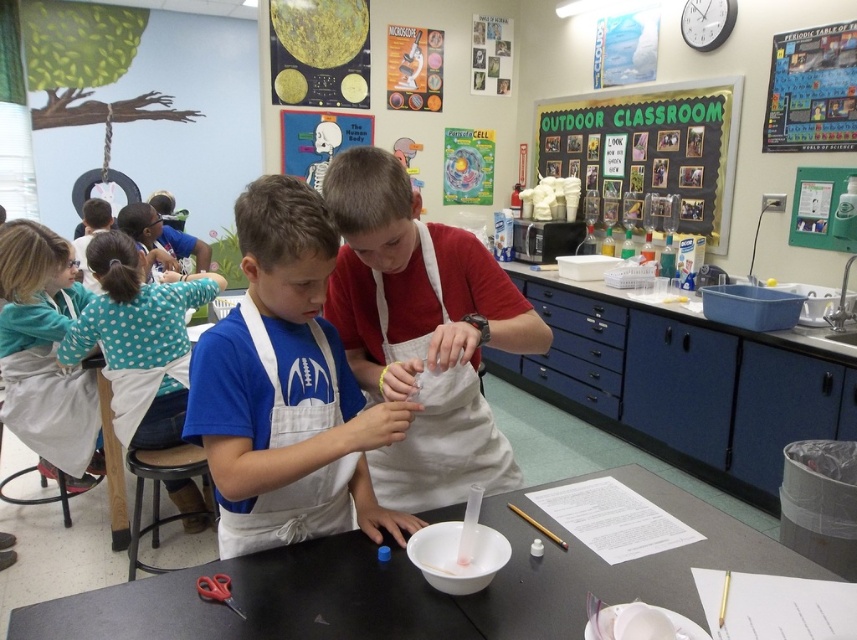
Question: Which point is closer to the camera?

Choices:
 (A) white apron at center
 (B) black matte table at center
 (C) teal polka dot shirt at upper left

Answer: (B)

Question: Which object is positioned farthest from the green chalkboard at upper center?

Choices:
 (A) teal polka dot shirt at upper left
 (B) white apron at left

Answer: (B)

Question: Is black matte table at center smaller than green chalkboard at upper center?

Choices:
 (A) no
 (B) yes

Answer: (B)

Question: Where is blue fabric shirt at center located in relation to white apron at center in the image?

Choices:
 (A) above
 (B) below

Answer: (B)

Question: Which of the following is the closest to the observer?

Choices:
 (A) (348, 568)
 (B) (678, 86)
 (C) (276, 515)

Answer: (A)

Question: From the image, what is the correct spatial relationship of white apron at center in relation to teal polka dot shirt at upper left?

Choices:
 (A) left
 (B) right

Answer: (B)